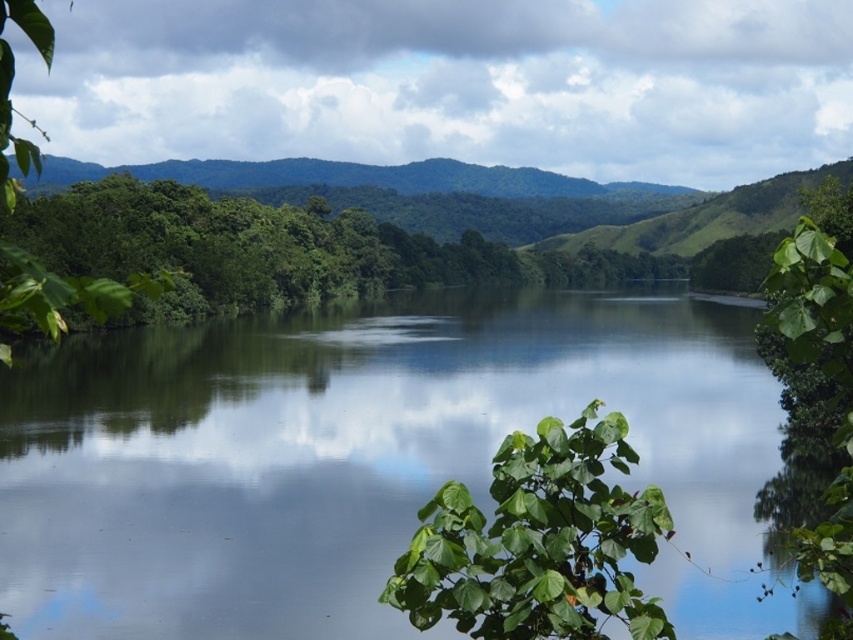
You are a photographer standing in the serene landscape and want to take a photo of both the point at coordinates point (99, 433) and point (442, 500). Which point will appear closer to the camera in your photo?

Point (99, 433) is further to the camera than point (442, 500), so the point at (442, 500) will appear closer to the camera in the photo.